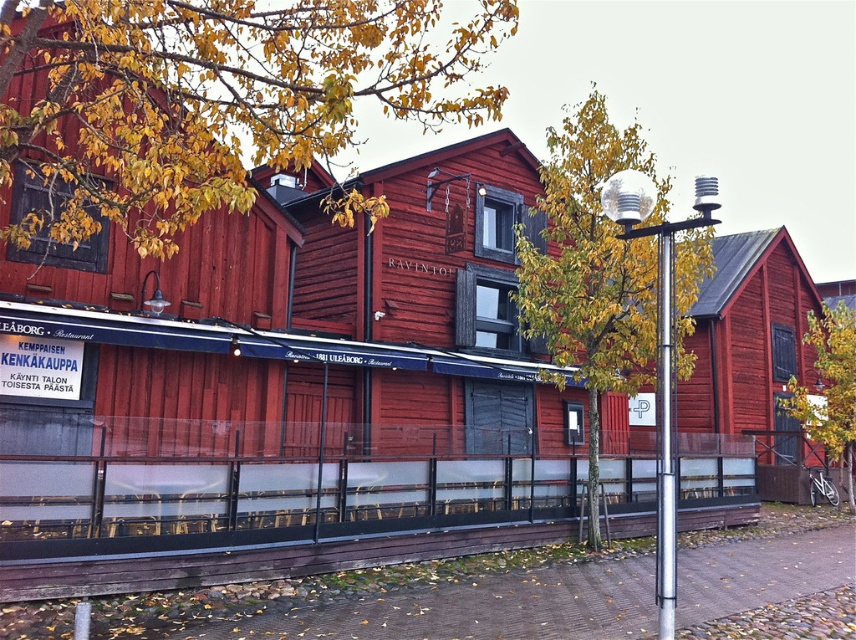
Which is below, yellow-green foliage at center or green leafy tree at lower right?

green leafy tree at lower right

Between point (563, 332) and point (825, 336), which one is positioned in front?

Point (563, 332)

This screenshot has width=856, height=640. I want to click on yellow-green foliage at center, so click(591, 264).

Who is more forward, (x=589, y=394) or (x=663, y=506)?

Point (x=663, y=506) is in front.

Which is behind, point (599, 362) or point (670, 358)?

The point (599, 362) is more distant.

Does point (629, 372) come farther from viewer compared to point (663, 332)?

Yes, point (629, 372) is behind point (663, 332).

Image resolution: width=856 pixels, height=640 pixels. Identify the location of yellow-green foliage at center. (591, 264).

Is green leafy tree at lower right above metallic pole at right?

No, green leafy tree at lower right is not above metallic pole at right.

Which of these two, green leafy tree at lower right or metallic pole at right, stands taller?

metallic pole at right

Locate an element on the screen. The image size is (856, 640). green leafy tree at lower right is located at coordinates click(829, 388).

You are a GUI agent. You are given a task and a screenshot of the screen. Output one action in this format:
    pyautogui.click(x=<x>, y=<y>)
    Task: Click on the green leafy tree at lower right
    The width and height of the screenshot is (856, 640).
    Given the screenshot: What is the action you would take?
    pyautogui.click(x=829, y=388)